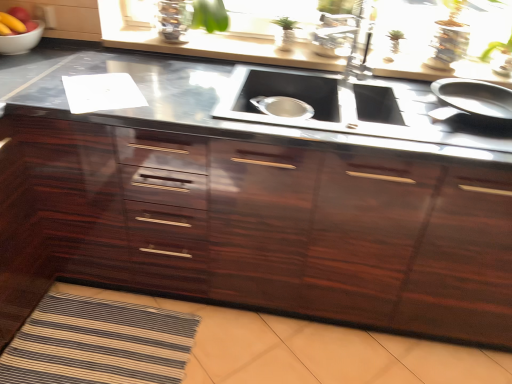
Question: Is smooth red apple at upper left shorter than glossy wood cabinetry at center?

Choices:
 (A) yes
 (B) no

Answer: (A)

Question: Can you confirm if smooth red apple at upper left is taller than glossy wood cabinetry at center?

Choices:
 (A) yes
 (B) no

Answer: (B)

Question: Does smooth red apple at upper left have a greater width compared to glossy wood cabinetry at center?

Choices:
 (A) no
 (B) yes

Answer: (A)

Question: From the image's perspective, would you say smooth red apple at upper left is positioned over glossy wood cabinetry at center?

Choices:
 (A) no
 (B) yes

Answer: (B)

Question: Does smooth red apple at upper left have a lesser width compared to glossy wood cabinetry at center?

Choices:
 (A) no
 (B) yes

Answer: (B)

Question: Is smooth red apple at upper left turned away from glossy wood cabinetry at center?

Choices:
 (A) no
 (B) yes

Answer: (A)

Question: From the image's perspective, is glossy wood cabinetry at center beneath white glossy bowl at upper left?

Choices:
 (A) yes
 (B) no

Answer: (A)

Question: From a real-world perspective, is glossy wood cabinetry at center positioned over white glossy bowl at upper left based on gravity?

Choices:
 (A) yes
 (B) no

Answer: (B)

Question: Is glossy wood cabinetry at center at the left side of white glossy bowl at upper left?

Choices:
 (A) yes
 (B) no

Answer: (B)

Question: Is there a large distance between glossy wood cabinetry at center and white glossy bowl at upper left?

Choices:
 (A) yes
 (B) no

Answer: (A)

Question: Is glossy wood cabinetry at center shorter than white glossy bowl at upper left?

Choices:
 (A) no
 (B) yes

Answer: (A)

Question: Is glossy wood cabinetry at center facing towards white glossy bowl at upper left?

Choices:
 (A) no
 (B) yes

Answer: (A)

Question: Considering the relative sizes of black stainless steel sink at center and white glossy bowl at upper left in the image provided, is black stainless steel sink at center thinner than white glossy bowl at upper left?

Choices:
 (A) yes
 (B) no

Answer: (B)